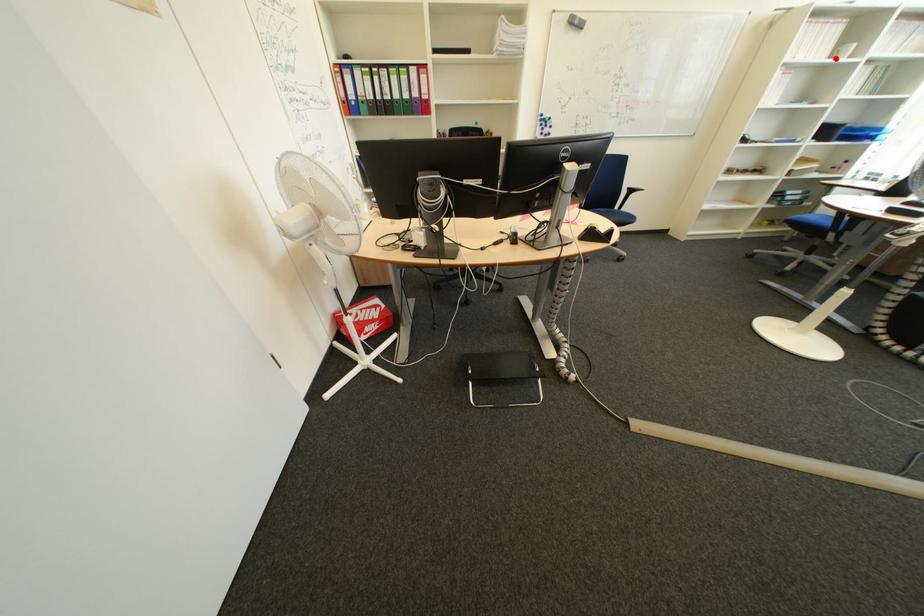
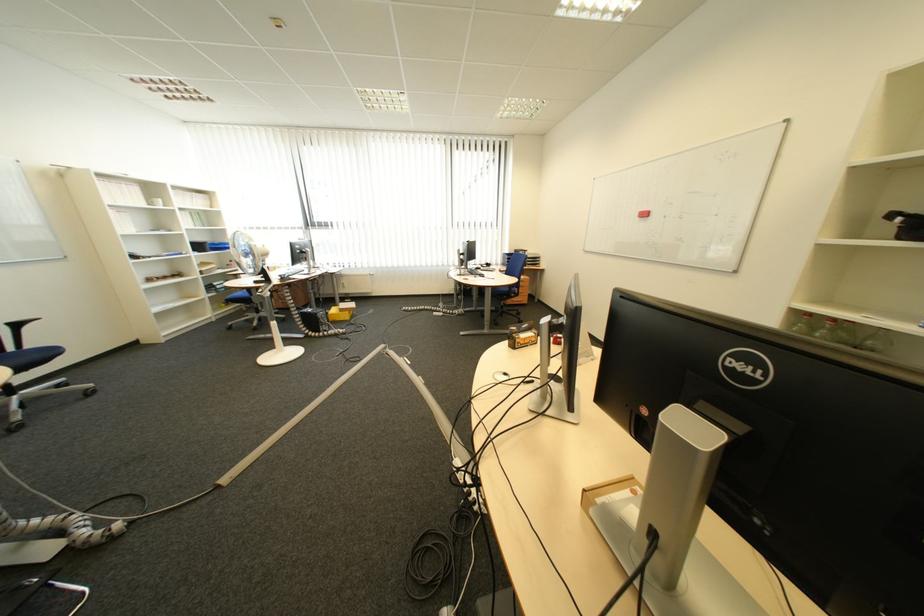
Question: I am providing you with two images of the same scene from different viewpoints. Given a red point in image1, look at the same physical point in image2. Is it:

Choices:
 (A) Closer to the viewpoint
 (B) Farther from the viewpoint

Answer: (A)